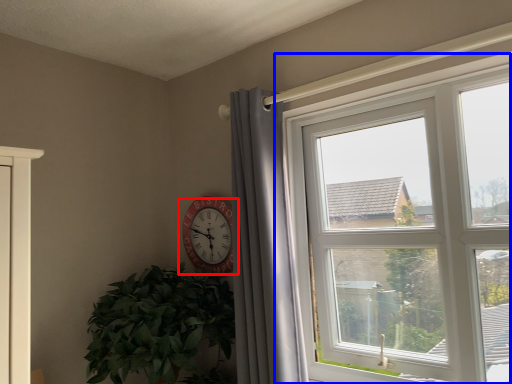
Question: Which point is further to the camera, wall clock (highlighted by a red box) or window (highlighted by a blue box)?

Choices:
 (A) wall clock
 (B) window

Answer: (A)